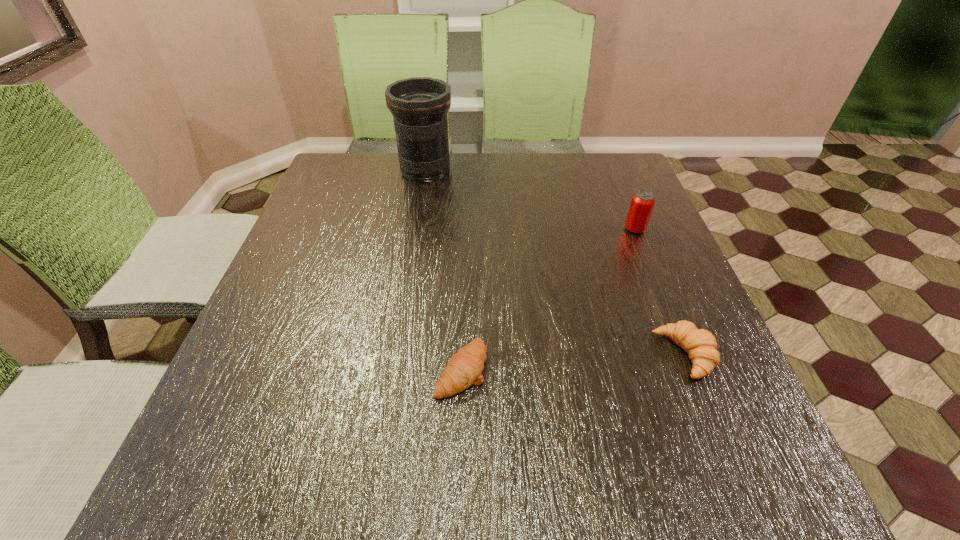
Locate an element on the screen. This screenshot has width=960, height=540. free space between the left crescent roll and the farthest object is located at coordinates (444, 271).

I want to click on free space between the farthest object and the right crescent roll, so click(555, 263).

I want to click on unoccupied position between the right crescent roll and the second farthest object, so click(660, 292).

Where is `free spot between the left crescent roll and the farthest object`? The height and width of the screenshot is (540, 960). free spot between the left crescent roll and the farthest object is located at coordinates (444, 271).

Locate an element on the screen. This screenshot has width=960, height=540. vacant space in between the can and the farthest object is located at coordinates (530, 200).

I want to click on free space between the left crescent roll and the telephoto lens, so [444, 271].

Locate an element on the screen. Image resolution: width=960 pixels, height=540 pixels. free area in between the right crescent roll and the telephoto lens is located at coordinates pyautogui.click(x=555, y=263).

Find the location of a particular element. The height and width of the screenshot is (540, 960). free space between the left crescent roll and the telephoto lens is located at coordinates (444, 271).

The image size is (960, 540). Identify the location of unoccupied position between the right crescent roll and the left crescent roll. (573, 363).

Select which object is the closest to the right crescent roll. Please provide its 2D coordinates. Your answer should be formatted as a tuple, i.e. [(x, y)], where the tuple contains the x and y coordinates of a point satisfying the conditions above.

[(642, 203)]